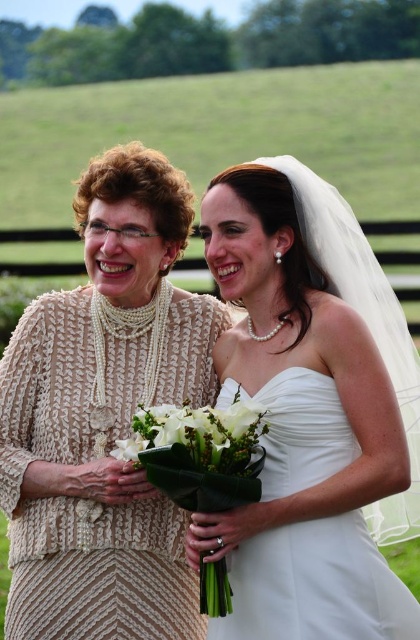
Which is more to the right, white matte bouquet at center or white matte flower at center?

white matte bouquet at center is more to the right.

Can you confirm if white matte bouquet at center is wider than white matte flower at center?

Yes, white matte bouquet at center is wider than white matte flower at center.

Who is more distant from viewer, (163, 420) or (136, 433)?

The point (136, 433) is behind.

The image size is (420, 640). I want to click on white matte bouquet at center, so click(x=199, y=433).

Is white satin dress at center further to the viewer compared to white matte bouquet at center?

Yes.

Can you confirm if white satin dress at center is positioned to the right of white matte bouquet at center?

Indeed, white satin dress at center is positioned on the right side of white matte bouquet at center.

Is point (414, 413) closer to viewer compared to point (193, 419)?

No, (414, 413) is further to viewer.

Identify the location of white satin dress at center. The width and height of the screenshot is (420, 640). (312, 412).

Is white satin dress at center smaller than white fabric bouquet at center?

Actually, white satin dress at center might be larger than white fabric bouquet at center.

Who is taller, white satin dress at center or white fabric bouquet at center?

white satin dress at center is taller.

Identify the location of white satin dress at center. The image size is (420, 640). (312, 412).

What are the coordinates of `white satin dress at center` in the screenshot? It's located at (312, 412).